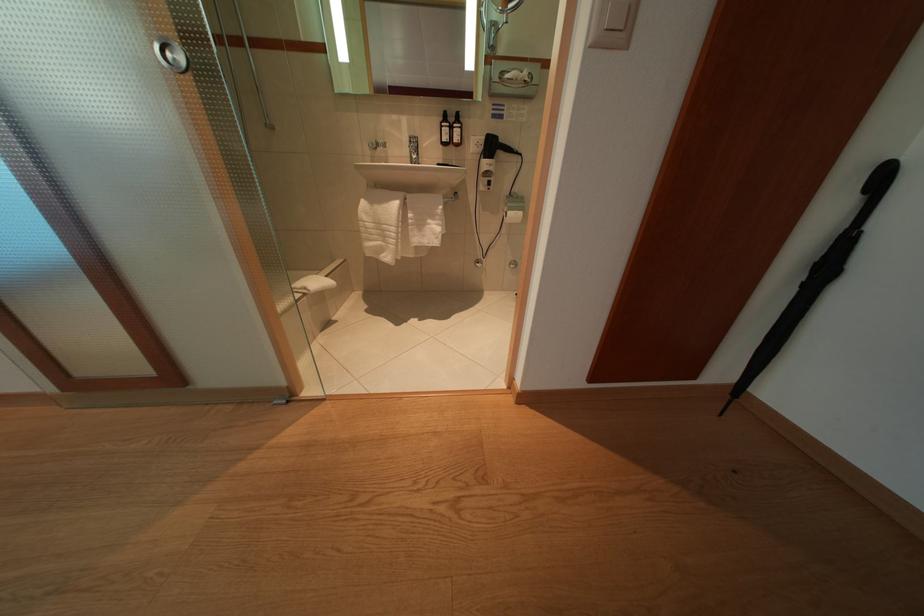
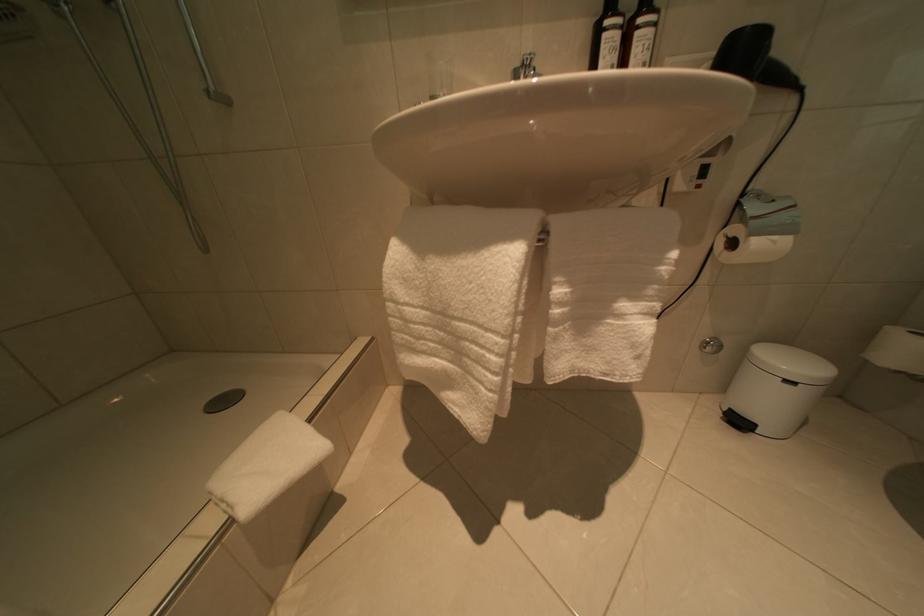
The point at (404, 209) is marked in the first image. Where is the corresponding point in the second image?

(517, 262)